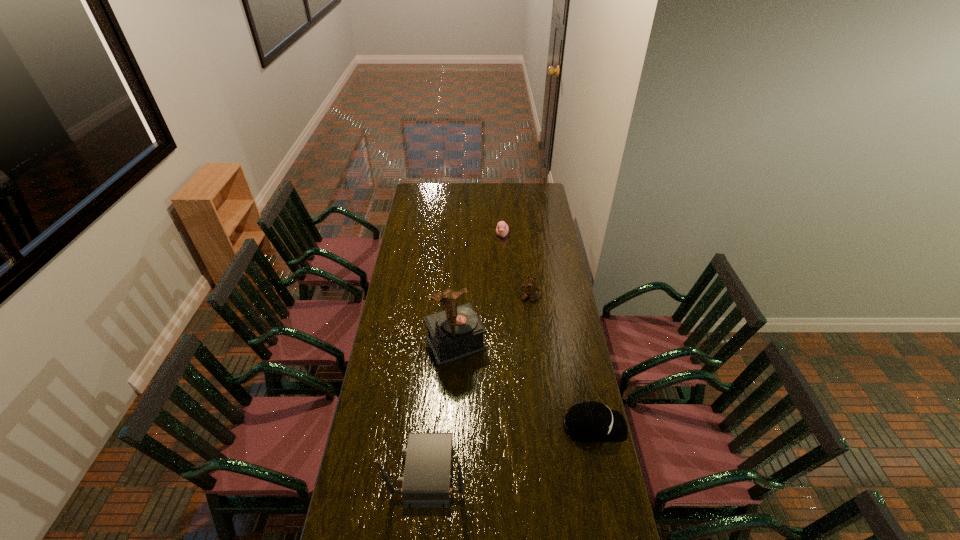
I want to click on vacant area situated 0.210m on the front-facing side of the duckling, so click(502, 265).

This screenshot has width=960, height=540. In order to click on free location located on the front-facing side of the duckling in this screenshot , I will do `click(502, 263)`.

The height and width of the screenshot is (540, 960). I want to click on vacant position located 0.180m at the face of the second farthest object, so click(x=521, y=329).

At what (x,y) coordinates should I click in order to perform the action: click on free space located at the face of the second farthest object. Please return your answer as a coordinate pair (x, y). Image resolution: width=960 pixels, height=540 pixels. Looking at the image, I should click on (524, 319).

Locate an element on the screen. This screenshot has height=540, width=960. vacant position located at the face of the second farthest object is located at coordinates (513, 364).

You are a GUI agent. You are given a task and a screenshot of the screen. Output one action in this format:
    pyautogui.click(x=<x>, y=<y>)
    Task: Click on the vacant space located at the horn opening of the third nearest object
    The width and height of the screenshot is (960, 540).
    Given the screenshot: What is the action you would take?
    pyautogui.click(x=498, y=425)

Where is `free space located at the horn opening of the third nearest object`? free space located at the horn opening of the third nearest object is located at coordinates (506, 441).

Identify the location of free location located at the horn opening of the third nearest object. The width and height of the screenshot is (960, 540). (474, 377).

You are a GUI agent. You are given a task and a screenshot of the screen. Output one action in this format:
    pyautogui.click(x=<x>, y=<y>)
    Task: Click on the object that is at the left edge
    The image size is (960, 540).
    Given the screenshot: What is the action you would take?
    pyautogui.click(x=426, y=480)

You are a GUI agent. You are given a task and a screenshot of the screen. Output one action in this format:
    pyautogui.click(x=<x>, y=<y>)
    Task: Click on the cap located at the right edge
    The image size is (960, 540).
    Given the screenshot: What is the action you would take?
    pyautogui.click(x=588, y=421)